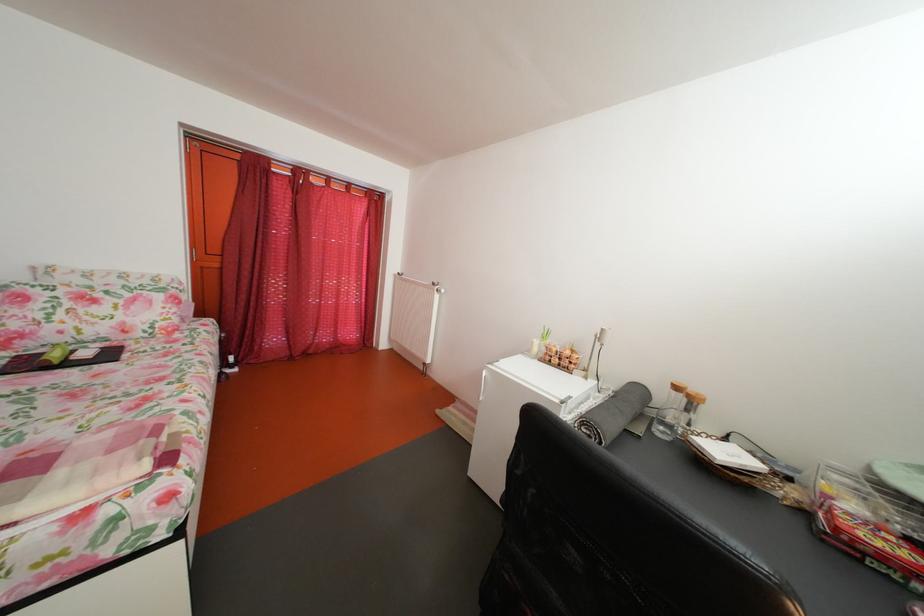
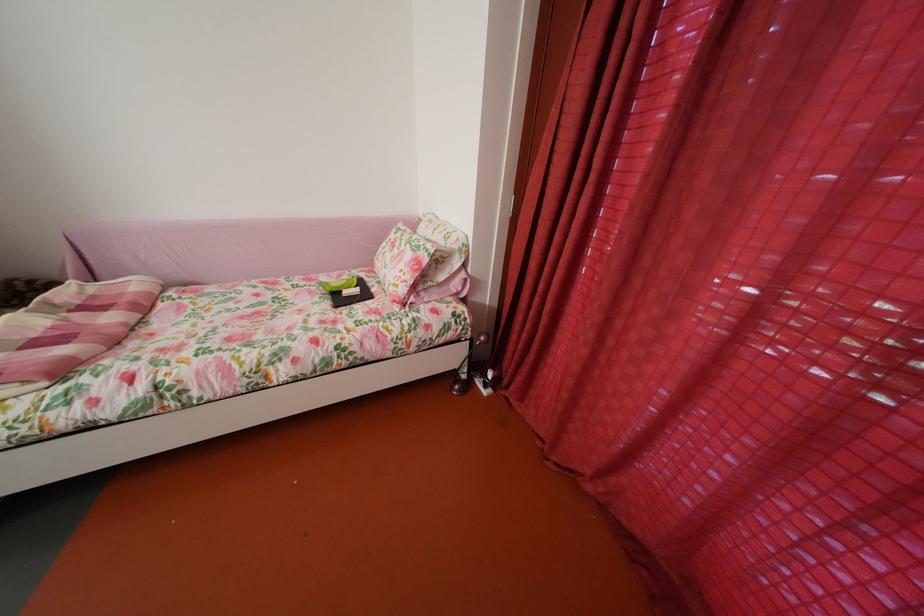
Locate, in the second image, the point that corresponds to point (169, 302) in the first image.

(419, 262)